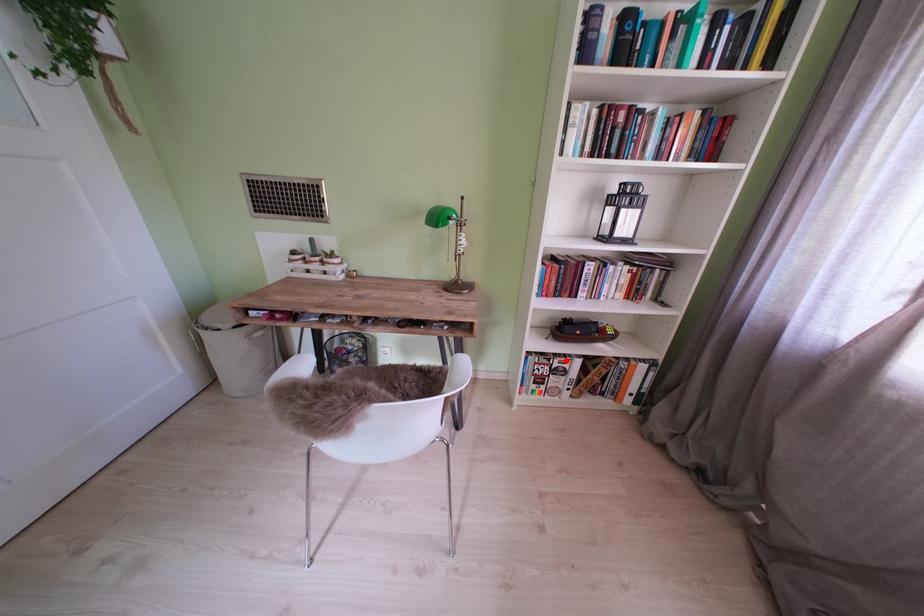
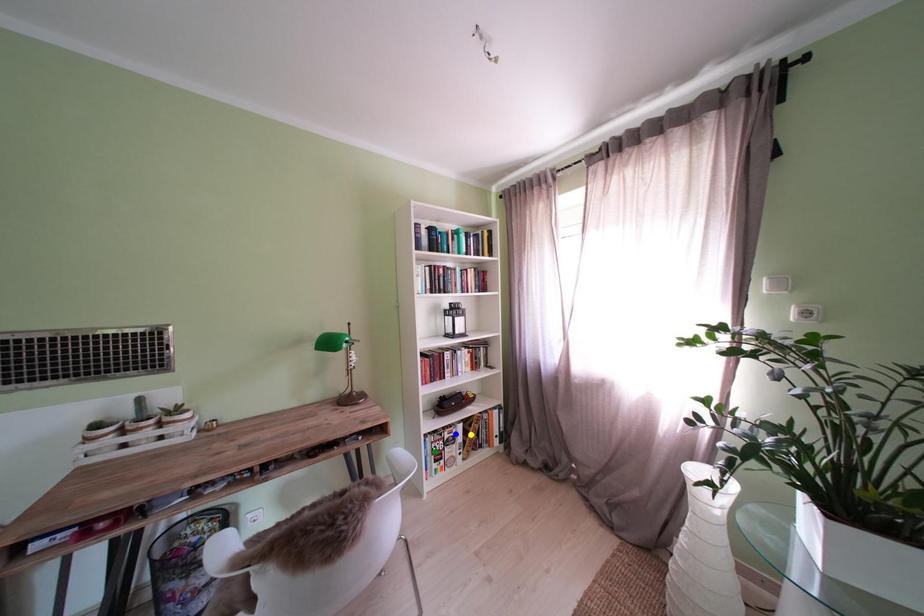
Question: I am providing you with two images of the same scene from different viewpoints. A red point is marked on the first image. You are given multiple points on the second image. Which mark in image 2 goes with the point in image 1?

Choices:
 (A) blue point
 (B) yellow point
 (C) green point

Answer: (A)